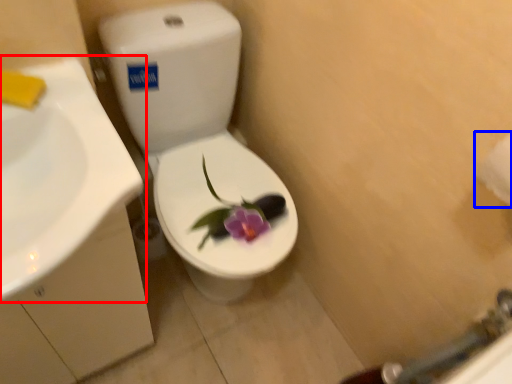
Question: Which of the following is the farthest to the observer, sink (highlighted by a red box) or toilet paper (highlighted by a blue box)?

Choices:
 (A) sink
 (B) toilet paper

Answer: (B)